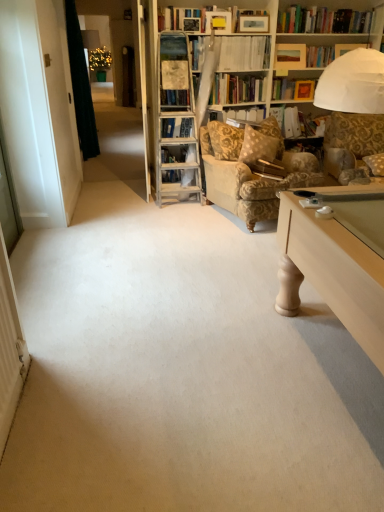
Question: Is fluffy beige pillow at right inside the boundaries of dark green fabric at left, or outside?

Choices:
 (A) inside
 (B) outside

Answer: (B)

Question: Is fluffy beige pillow at right taller or shorter than dark green fabric at left?

Choices:
 (A) tall
 (B) short

Answer: (B)

Question: Which is nearer to the fluffy beige pillow at right?

Choices:
 (A) white paper folder at upper center, the 3th book when ordered from front to back
 (B) dark green fabric at left
 (C) gold-patterned fabric armchair at center-right
 (D) hardcover book at upper center, which is counted as the 2th book, starting from the front
 (E) hardcover book at center, the first book positioned from the bottom

Answer: (E)

Question: Which is farther from the hardcover book at upper center, positioned as the 3th book in bottom-to-top order?

Choices:
 (A) fluffy beige pillow at right
 (B) white paper folder at upper center, which appears as the second book when viewed from the top
 (C) dark green fabric at left
 (D) hardcover book at center, which appears as the third book when viewed from the back
 (E) gold-patterned fabric armchair at center-right

Answer: (C)